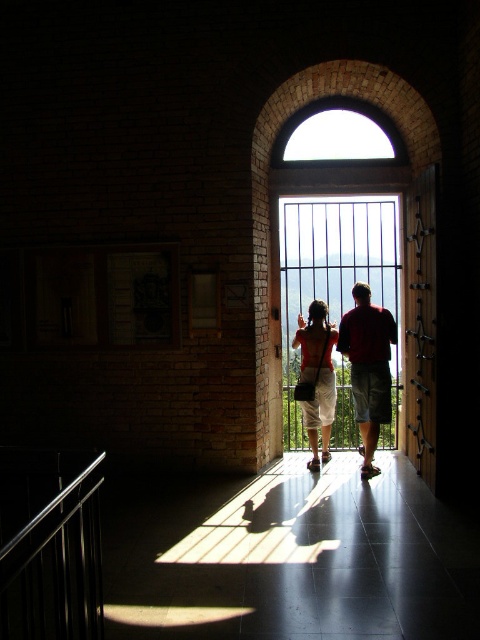
You are standing in the historic building and want to take a photo of the clear glass window at center and the matte red shirt at center. Since you have a wide angle lens, which object should you focus on first to ensure both are in frame?

You should focus on the clear glass window at center first because its width is larger than the matte red shirt at center, so it will occupy more space in the photo and help frame the composition.

You are standing in the historic building and want to touch both the polished metal balustrade at lower left and the matte red shirt at center. Which object should you reach for first to touch the one closer to you?

You should reach for the polished metal balustrade at lower left first because it is closer to you than the matte red shirt at center.